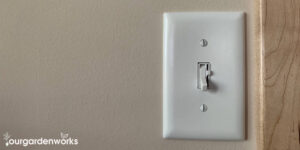
Identify the location of top left corner of switchplate. (165, 15).